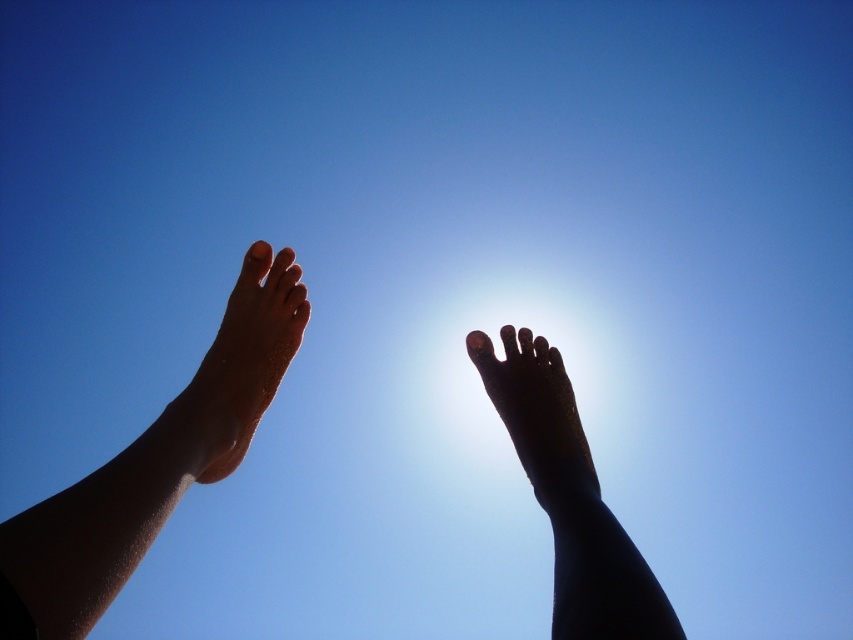
Question: Is sandy feet at center wider than black matte foot at center?

Choices:
 (A) no
 (B) yes

Answer: (A)

Question: Is sandy feet at center below sandy tan foot at upper left?

Choices:
 (A) yes
 (B) no

Answer: (A)

Question: Which object is closer to the camera taking this photo?

Choices:
 (A) sandy feet at center
 (B) black matte foot at upper center
 (C) sandy skin leg at left
 (D) black matte foot at center

Answer: (C)

Question: Among these objects, which one is farthest from the camera?

Choices:
 (A) sandy feet at center
 (B) black matte foot at upper center
 (C) sandy tan foot at upper left

Answer: (C)

Question: Which point is farther to the camera?

Choices:
 (A) black matte foot at center
 (B) black matte foot at upper center

Answer: (A)

Question: Can you confirm if sandy skin leg at left is positioned to the right of black matte foot at center?

Choices:
 (A) no
 (B) yes

Answer: (A)